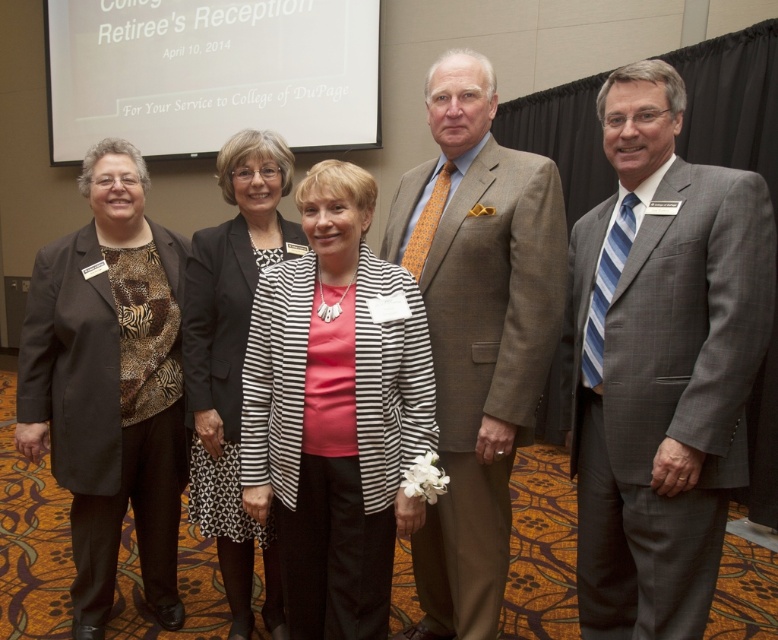
I want to click on brown textured suit at center, so click(x=475, y=332).

How distant is brown textured suit at center from matte black blazer at left?

brown textured suit at center is 1.01 meters from matte black blazer at left.

Is point (499, 541) positioned in front of point (124, 301)?

Yes, it is in front of point (124, 301).

The image size is (778, 640). Find the location of `brown textured suit at center`. brown textured suit at center is located at coordinates (475, 332).

Can you confirm if gray textured suit at center is smaller than black and white striped dress at center?

Incorrect, gray textured suit at center is not smaller in size than black and white striped dress at center.

From the picture: Is gray textured suit at center taller than black and white striped dress at center?

Incorrect, gray textured suit at center's height is not larger of black and white striped dress at center's.

Does point (656, 172) come behind point (246, 140)?

That is False.

This screenshot has height=640, width=778. Identify the location of gray textured suit at center. (x=661, y=362).

Between gray textured suit at center and striped fabric jacket at center, which one has more height?

With more height is gray textured suit at center.

Is gray textured suit at center below striped fabric jacket at center?

Actually, gray textured suit at center is above striped fabric jacket at center.

From the picture: Measure the distance between point (580, 376) and camera.

Point (580, 376) is 1.83 meters away from camera.

This screenshot has height=640, width=778. What are the coordinates of `gray textured suit at center` in the screenshot? It's located at (661, 362).